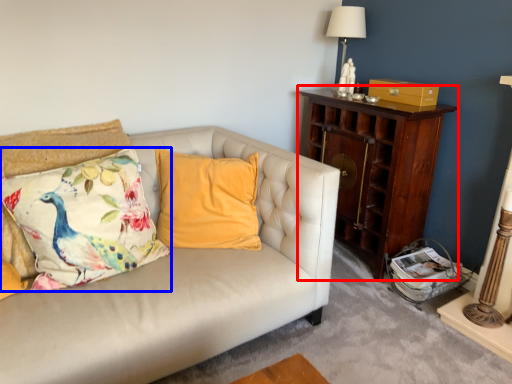
Question: Which object is further to the camera taking this photo, nightstand (highlighted by a red box) or pillow (highlighted by a blue box)?

Choices:
 (A) nightstand
 (B) pillow

Answer: (A)